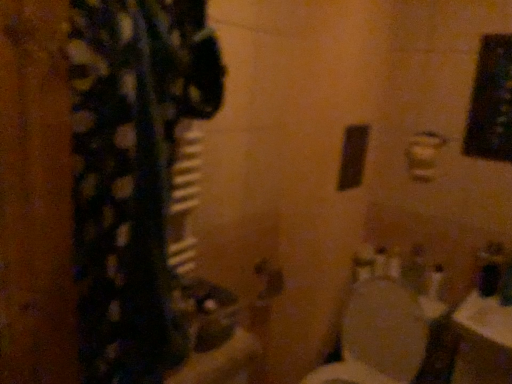
Question: Considering the relative sizes of metallic silver door handle at center and white glossy toilet at lower right in the image provided, is metallic silver door handle at center shorter than white glossy toilet at lower right?

Choices:
 (A) no
 (B) yes

Answer: (B)

Question: Is metallic silver door handle at center completely or partially outside of white glossy toilet at lower right?

Choices:
 (A) yes
 (B) no

Answer: (A)

Question: Does metallic silver door handle at center have a smaller size compared to white glossy toilet at lower right?

Choices:
 (A) yes
 (B) no

Answer: (A)

Question: Does metallic silver door handle at center come behind white glossy toilet at lower right?

Choices:
 (A) no
 (B) yes

Answer: (B)

Question: From a real-world perspective, is metallic silver door handle at center located beneath white glossy toilet at lower right?

Choices:
 (A) yes
 (B) no

Answer: (B)

Question: Is white glossy toilet at lower right at the back of metallic silver door handle at center?

Choices:
 (A) yes
 (B) no

Answer: (B)

Question: From the image's perspective, would you say white glossy toilet at lower right is shown under metallic silver door handle at center?

Choices:
 (A) yes
 (B) no

Answer: (A)

Question: Does white glossy toilet at lower right contain metallic silver door handle at center?

Choices:
 (A) yes
 (B) no

Answer: (B)

Question: Is white glossy toilet at lower right not near metallic silver door handle at center?

Choices:
 (A) no
 (B) yes

Answer: (A)

Question: From a real-world perspective, is white glossy toilet at lower right located beneath metallic silver door handle at center?

Choices:
 (A) no
 (B) yes

Answer: (B)

Question: Is the position of white glossy toilet at lower right more distant than that of metallic silver door handle at center?

Choices:
 (A) no
 (B) yes

Answer: (A)

Question: Are white glossy toilet at lower right and metallic silver door handle at center beside each other?

Choices:
 (A) yes
 (B) no

Answer: (B)

Question: Considering the relative positions of metallic silver door handle at center and white glossy toilet at lower right in the image provided, is metallic silver door handle at center to the left or to the right of white glossy toilet at lower right?

Choices:
 (A) right
 (B) left

Answer: (B)